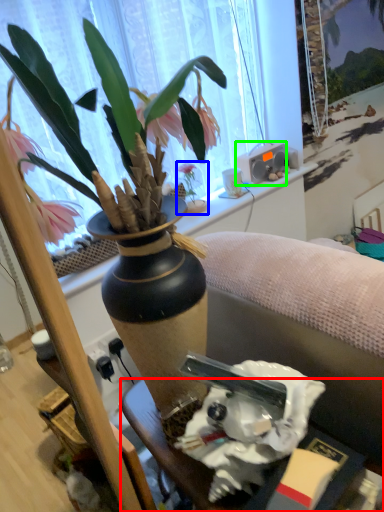
Question: Which is nearer to the desk (highlighted by a red box)? houseplant (highlighted by a blue box) or loudspeaker (highlighted by a green box).

Choices:
 (A) houseplant
 (B) loudspeaker

Answer: (A)